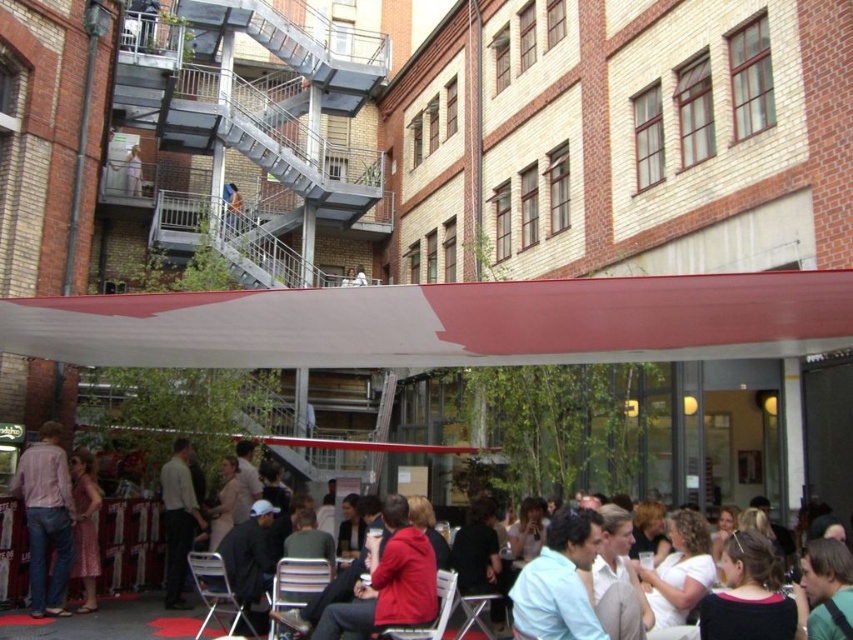
Question: Which point appears farthest from the camera in this image?

Choices:
 (A) (50, 528)
 (B) (141, 547)

Answer: (B)

Question: Observing the image, what is the correct spatial positioning of red fabric chair at center in reference to light brown leather jacket at lower center?

Choices:
 (A) below
 (B) above

Answer: (A)

Question: Does red fabric chair at center appear on the right side of plaid shirt at lower left?

Choices:
 (A) no
 (B) yes

Answer: (B)

Question: Which object is the closest to the light brown leather jacket at lower center?

Choices:
 (A) red fabric chair at center
 (B) plaid shirt at lower left

Answer: (B)

Question: Does red fabric chair at center appear over plaid shirt at lower left?

Choices:
 (A) no
 (B) yes

Answer: (A)

Question: Which object is the farthest from the light brown leather jacket at lower center?

Choices:
 (A) red fabric chair at center
 (B) plaid shirt at lower left

Answer: (A)